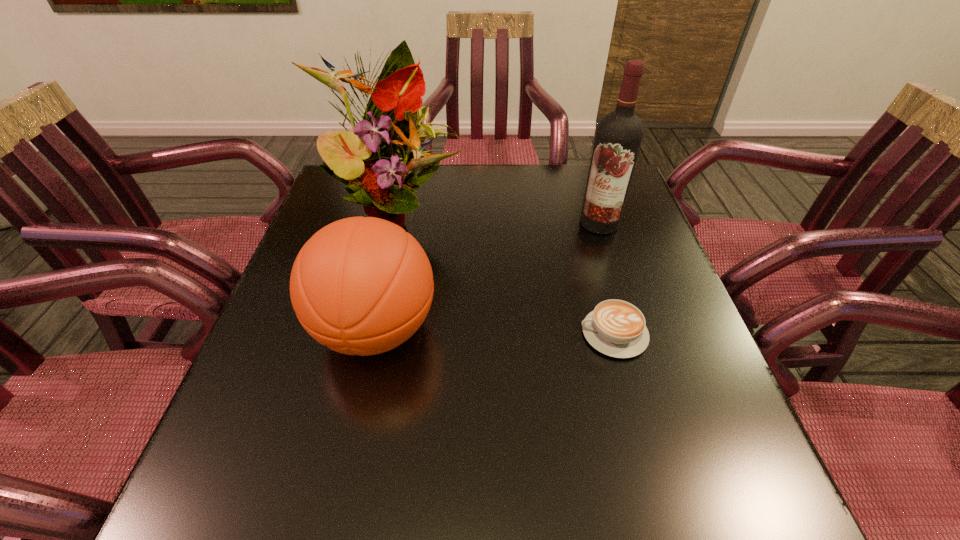
Where is `free spot located 0.120m on the front-facing side of the bouquet`? free spot located 0.120m on the front-facing side of the bouquet is located at coordinates pyautogui.click(x=444, y=266).

Where is `vacant position located on the label of the wine bottle`? This screenshot has height=540, width=960. vacant position located on the label of the wine bottle is located at coordinates (579, 241).

Locate an element on the screen. The image size is (960, 540). vacant space located 0.370m on the label of the wine bottle is located at coordinates (500, 313).

You are a GUI agent. You are given a task and a screenshot of the screen. Output one action in this format:
    pyautogui.click(x=<x>, y=<y>)
    Task: Click on the vacant area situated on the label of the wine bottle
    
    Given the screenshot: What is the action you would take?
    pyautogui.click(x=506, y=308)

Image resolution: width=960 pixels, height=540 pixels. Identify the location of object that is positioned at the far edge. (379, 170).

Identify the location of basketball situated at the left edge. (362, 286).

Identify the location of bouquet situated at the left edge. Image resolution: width=960 pixels, height=540 pixels. (379, 170).

Locate an element on the screen. The image size is (960, 540). cappuccino that is at the right edge is located at coordinates (616, 328).

I want to click on wine bottle present at the right edge, so pyautogui.click(x=619, y=135).

Locate an element on the screen. The height and width of the screenshot is (540, 960). object present at the far left corner is located at coordinates 379,170.